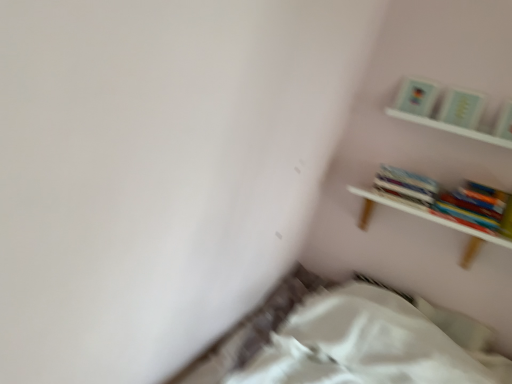
Find the location of a particular element. vacant region above white wooden shelf at upper right, which is counted as the second shelf, starting from the bottom (from a real-world perspective) is located at coordinates (445, 126).